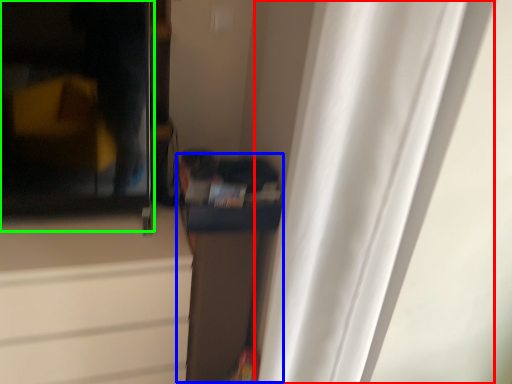
Question: Considering the real-world distances, which object is farthest from curtain (highlighted by a red box)? cabinetry (highlighted by a blue box) or screen door (highlighted by a green box)?

Choices:
 (A) cabinetry
 (B) screen door

Answer: (B)